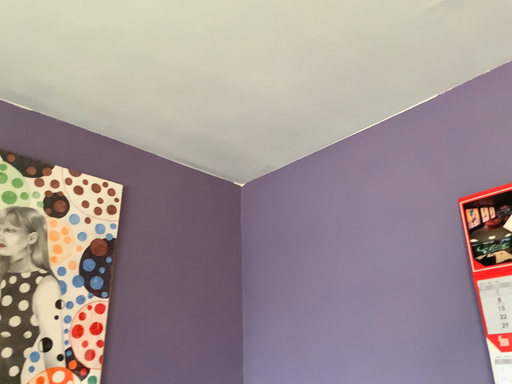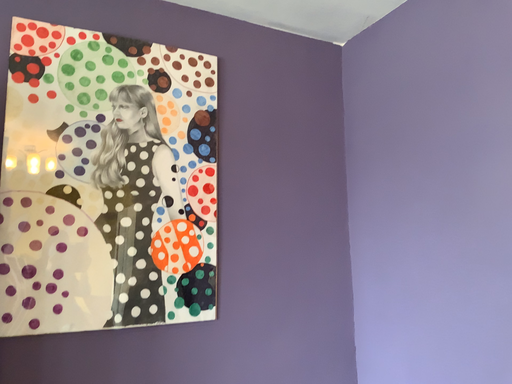
Question: Which way did the camera rotate in the video?

Choices:
 (A) rotated downward
 (B) rotated upward

Answer: (A)